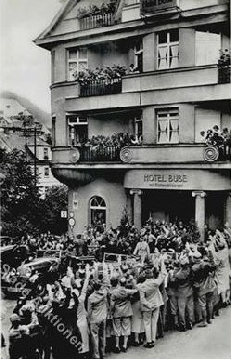
Locate an element on the screen. Image resolution: width=231 pixels, height=359 pixels. curtain is located at coordinates (164, 132), (175, 126), (165, 52), (178, 59), (81, 58), (76, 68).